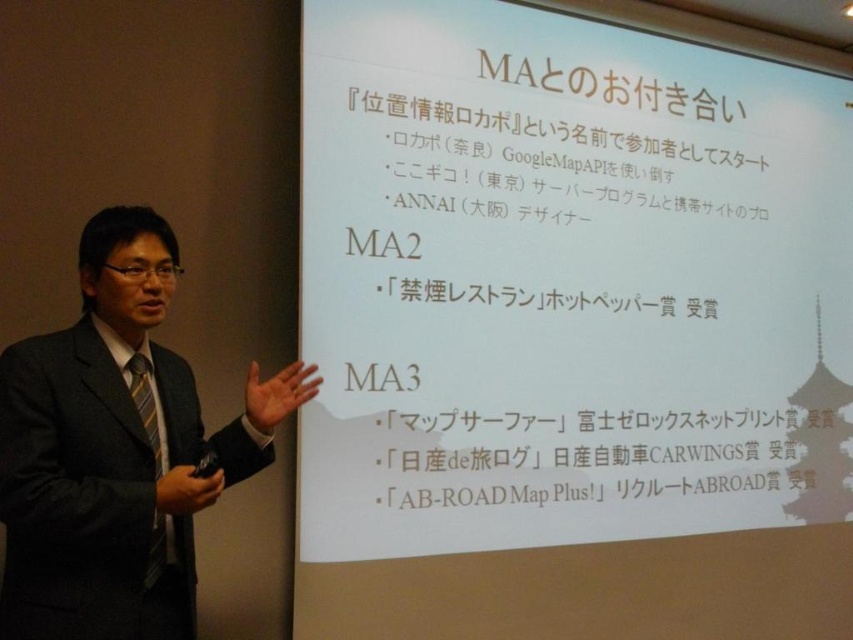
Question: Which point appears closest to the camera in this image?

Choices:
 (A) (102, 496)
 (B) (527, 195)

Answer: (A)

Question: Does white paper at upper center have a greater width compared to dark gray suit at left?

Choices:
 (A) no
 (B) yes

Answer: (B)

Question: Is white paper at upper center further to camera compared to dark gray suit at left?

Choices:
 (A) yes
 (B) no

Answer: (A)

Question: Which point is farther to the camera?

Choices:
 (A) 759,212
 (B) 93,216

Answer: (A)

Question: Observing the image, what is the correct spatial positioning of white paper at upper center in reference to dark gray suit at left?

Choices:
 (A) right
 (B) left

Answer: (A)